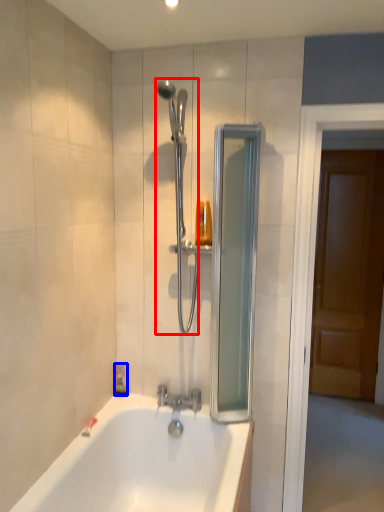
Question: Which of the following is the closest to the observer, shower (highlighted by a red box) or soap dispenser (highlighted by a blue box)?

Choices:
 (A) shower
 (B) soap dispenser

Answer: (A)